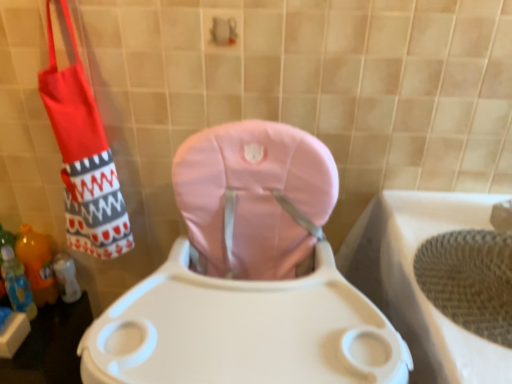
This screenshot has width=512, height=384. Describe the element at coordinates (416, 281) in the screenshot. I see `woven beige bath at lower right` at that location.

I want to click on translucent orange bottle at lower left, the second bottle positioned from the front, so click(37, 265).

The height and width of the screenshot is (384, 512). Describe the element at coordinates (37, 265) in the screenshot. I see `translucent orange bottle at lower left, the second bottle positioned from the front` at that location.

What is the approximate width of translucent orange bottle at lower left, arranged as the second bottle when viewed from the back?

translucent orange bottle at lower left, arranged as the second bottle when viewed from the back, is 3.09 inches in width.

Where is `red fabric shoulder bag at left`? red fabric shoulder bag at left is located at coordinates (x=84, y=157).

Locate an element on the screen. The height and width of the screenshot is (384, 512). woven beige bath at lower right is located at coordinates (416, 281).

Based on the photo, from the image's perspective, is woven beige bath at lower right on top of translucent orange bottle at lower left, which appears as the 1th bottle when viewed from the front?

No, from the image's perspective, woven beige bath at lower right is not over translucent orange bottle at lower left, which appears as the 1th bottle when viewed from the front.

Is woven beige bath at lower right shorter than translucent orange bottle at lower left, which appears as the 1th bottle when viewed from the front?

No.

Considering the sizes of woven beige bath at lower right and translucent orange bottle at lower left, arranged as the second bottle when viewed from the back, in the image, is woven beige bath at lower right bigger or smaller than translucent orange bottle at lower left, arranged as the second bottle when viewed from the back,?

Considering their sizes, woven beige bath at lower right takes up more space than translucent orange bottle at lower left, arranged as the second bottle when viewed from the back.

Can you confirm if translucent orange bottle at lower left, which ranks as the 1th bottle in back-to-front order, is taller than red fabric shoulder bag at left?

In fact, translucent orange bottle at lower left, which ranks as the 1th bottle in back-to-front order, may be shorter than red fabric shoulder bag at left.

In the scene shown: From the image's perspective, would you say translucent orange bottle at lower left, which ranks as the 1th bottle in back-to-front order, is shown under red fabric shoulder bag at left?

Yes, from the image's perspective, translucent orange bottle at lower left, which ranks as the 1th bottle in back-to-front order, is below red fabric shoulder bag at left.

I want to click on the 2nd bottle behind the red fabric shoulder bag at left, counting from the anchor's position, so click(x=37, y=265).

Which is behind, translucent orange bottle at lower left, the second bottle positioned from the front, or red fabric shoulder bag at left?

translucent orange bottle at lower left, the second bottle positioned from the front, is further from the camera.

Based on their sizes in the image, would you say pink fabric toilet at center is bigger or smaller than woven beige bath at lower right?

In the image, pink fabric toilet at center appears to be larger than woven beige bath at lower right.

Is point (247, 150) closer or farther from the camera than point (449, 208)?

Clearly, point (247, 150) is closer to the camera than point (449, 208).

Relative to woven beige bath at lower right, is pink fabric toilet at center in front or behind?

Visually, pink fabric toilet at center is located in front of woven beige bath at lower right.

In the scene shown: Is pink fabric toilet at center turned away from woven beige bath at lower right?

No, pink fabric toilet at center is not facing the opposite direction of woven beige bath at lower right.

Are woven beige bath at lower right and pink fabric toilet at center far apart?

No, woven beige bath at lower right is in close proximity to pink fabric toilet at center.

Would you say woven beige bath at lower right is outside pink fabric toilet at center?

Yes, woven beige bath at lower right is not within pink fabric toilet at center.

From the image's perspective, between woven beige bath at lower right and pink fabric toilet at center, who is located below?

woven beige bath at lower right appears lower in the image.

Which object is thinner, woven beige bath at lower right or pink fabric toilet at center?

woven beige bath at lower right.

Are pink fabric toilet at center and translucent orange bottle at lower left, arranged as the second bottle when viewed from the back, beside each other?

No, pink fabric toilet at center is not with translucent orange bottle at lower left, arranged as the second bottle when viewed from the back.

From the picture: Is pink fabric toilet at center not within translucent orange bottle at lower left, which appears as the 1th bottle when viewed from the front?

Yes.

Between pink fabric toilet at center and translucent orange bottle at lower left, which appears as the 1th bottle when viewed from the front, which one is positioned in front?

pink fabric toilet at center is more forward.

Is pink fabric toilet at center oriented towards translucent orange bottle at lower left, arranged as the second bottle when viewed from the back?

No.

Considering the relative positions of red fabric shoulder bag at left and pink fabric toilet at center in the image provided, is red fabric shoulder bag at left to the right of pink fabric toilet at center from the viewer's perspective?

In fact, red fabric shoulder bag at left is to the left of pink fabric toilet at center.

Is red fabric shoulder bag at left looking in the opposite direction of pink fabric toilet at center?

red fabric shoulder bag at left is not turned away from pink fabric toilet at center.

Is pink fabric toilet at center located within red fabric shoulder bag at left?

No, pink fabric toilet at center is not a part of red fabric shoulder bag at left.

Can you tell me how much red fabric shoulder bag at left and pink fabric toilet at center differ in facing direction?

There is a 4.93-degree angle between the facing directions of red fabric shoulder bag at left and pink fabric toilet at center.

Considering the relative positions of translucent orange bottle at lower left, which ranks as the 1th bottle in back-to-front order, and woven beige bath at lower right in the image provided, is translucent orange bottle at lower left, which ranks as the 1th bottle in back-to-front order, behind woven beige bath at lower right?

Yes, translucent orange bottle at lower left, which ranks as the 1th bottle in back-to-front order, is further from the viewer.

In terms of size, does translucent orange bottle at lower left, which ranks as the 1th bottle in back-to-front order, appear bigger or smaller than woven beige bath at lower right?

Considering their sizes, translucent orange bottle at lower left, which ranks as the 1th bottle in back-to-front order, takes up less space than woven beige bath at lower right.

Based on the photo, is translucent orange bottle at lower left, the second bottle positioned from the front, touching woven beige bath at lower right?

No, translucent orange bottle at lower left, the second bottle positioned from the front, is not in contact with woven beige bath at lower right.

Is woven beige bath at lower right located within translucent orange bottle at lower left, which ranks as the 1th bottle in back-to-front order?

Definitely not — woven beige bath at lower right is not inside translucent orange bottle at lower left, which ranks as the 1th bottle in back-to-front order.

You are a GUI agent. You are given a task and a screenshot of the screen. Output one action in this format:
    pyautogui.click(x=<x>, y=<y>)
    Task: Click on the bath lying on the right of translucent orange bottle at lower left, which appears as the 1th bottle when viewed from the front
    This screenshot has height=384, width=512.
    Given the screenshot: What is the action you would take?
    pyautogui.click(x=416, y=281)

The image size is (512, 384). I want to click on the 2nd bottle behind the red fabric shoulder bag at left, so click(x=37, y=265).

Estimate the real-world distances between objects in this image. Which object is closer to translucent orange bottle at lower left, which ranks as the 1th bottle in back-to-front order, red fabric shoulder bag at left or woven beige bath at lower right?

red fabric shoulder bag at left lies closer to translucent orange bottle at lower left, which ranks as the 1th bottle in back-to-front order, than the other object.

When comparing their distances from woven beige bath at lower right, does translucent orange bottle at lower left, arranged as the second bottle when viewed from the back, or red fabric shoulder bag at left seem closer?

red fabric shoulder bag at left lies closer to woven beige bath at lower right than the other object.

Which object lies nearer to the anchor point red fabric shoulder bag at left, translucent orange bottle at lower left, the second bottle positioned from the front, or pink fabric toilet at center?

The object closer to red fabric shoulder bag at left is translucent orange bottle at lower left, the second bottle positioned from the front.

Which object lies nearer to the anchor point pink fabric toilet at center, red fabric shoulder bag at left or translucent orange bottle at lower left, arranged as the second bottle when viewed from the back?

red fabric shoulder bag at left lies closer to pink fabric toilet at center than the other object.

Considering their positions, is red fabric shoulder bag at left positioned closer to woven beige bath at lower right than translucent orange bottle at lower left, which appears as the 1th bottle when viewed from the front?

red fabric shoulder bag at left lies closer to woven beige bath at lower right than the other object.

From the image, which object appears to be farther from woven beige bath at lower right, translucent orange bottle at lower left, which appears as the 1th bottle when viewed from the front, or pink fabric toilet at center?

Based on the image, translucent orange bottle at lower left, which appears as the 1th bottle when viewed from the front, appears to be further to woven beige bath at lower right.

From the image, which object appears to be farther from translucent orange bottle at lower left, which appears as the 1th bottle when viewed from the front, translucent orange bottle at lower left, which ranks as the 1th bottle in back-to-front order, or woven beige bath at lower right?

woven beige bath at lower right is positioned further to the anchor translucent orange bottle at lower left, which appears as the 1th bottle when viewed from the front.

Looking at the image, which one is located further to translucent orange bottle at lower left, which appears as the 1th bottle when viewed from the front, woven beige bath at lower right or translucent orange bottle at lower left, which ranks as the 1th bottle in back-to-front order?

woven beige bath at lower right is further to translucent orange bottle at lower left, which appears as the 1th bottle when viewed from the front.

Locate an element on the screen. This screenshot has height=384, width=512. toilet between translucent orange bottle at lower left, which appears as the 1th bottle when viewed from the front, and woven beige bath at lower right from left to right is located at coordinates (247, 278).

What are the coordinates of `toilet located between translucent orange bottle at lower left, the second bottle positioned from the front, and woven beige bath at lower right in the left-right direction` in the screenshot? It's located at (247, 278).

I want to click on bottle between pink fabric toilet at center and translucent orange bottle at lower left, the second bottle positioned from the front, in the front-back direction, so click(x=17, y=284).

Identify the location of toilet located between red fabric shoulder bag at left and woven beige bath at lower right in the left-right direction. (247, 278).